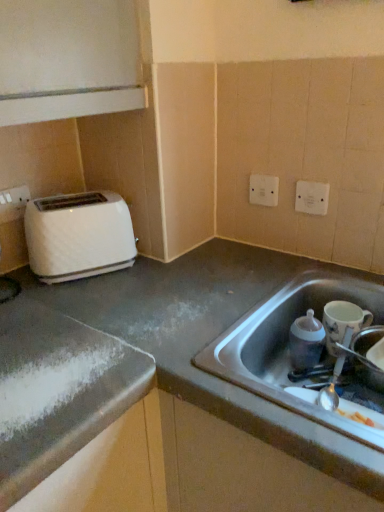
Find the location of `free location to the right of white plastic toaster at left`. free location to the right of white plastic toaster at left is located at coordinates (159, 274).